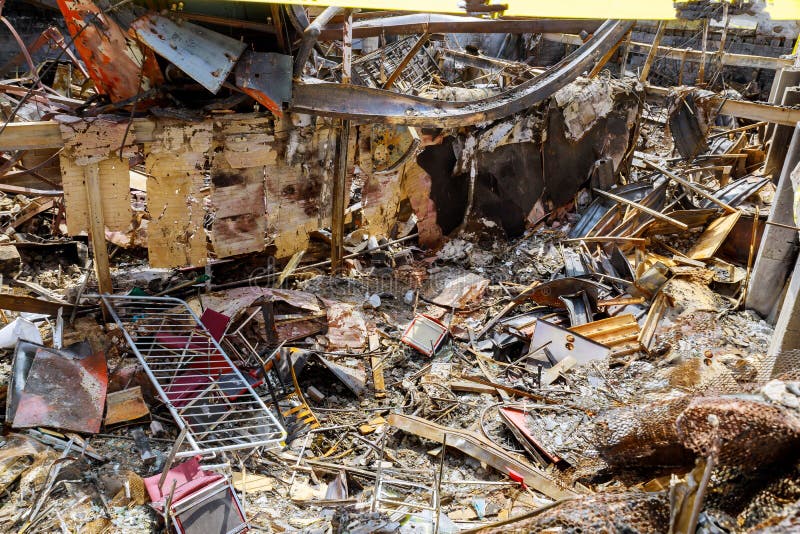
I want to click on old box spring, so click(370, 70).